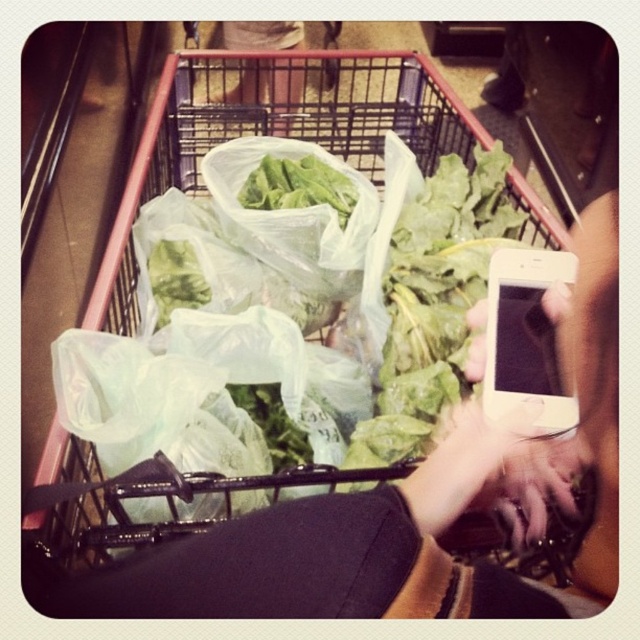
You are a delivery robot with a 12 inch wide package. You need to move through the space between the clear plastic shopping cart at center and the matte plastic pants at center. Can you fit through that space with your package?

The distance between the clear plastic shopping cart at center and the matte plastic pants at center is 14.40 inches, so the robot can fit through the space since the package is only 12 inches wide.

You are navigating a narrow aisle in a grocery store and see two points marked on the floor. The first point is at point (x=257, y=49) and the second is at point (x=289, y=177). If you are facing the direction of the shopping cart, which point should you step on first to avoid obstacles?

Point (x=257, y=49) is behind point (x=289, y=177), so you should step on point (x=289, y=177) first as it is closer to your current position when facing the shopping cart.